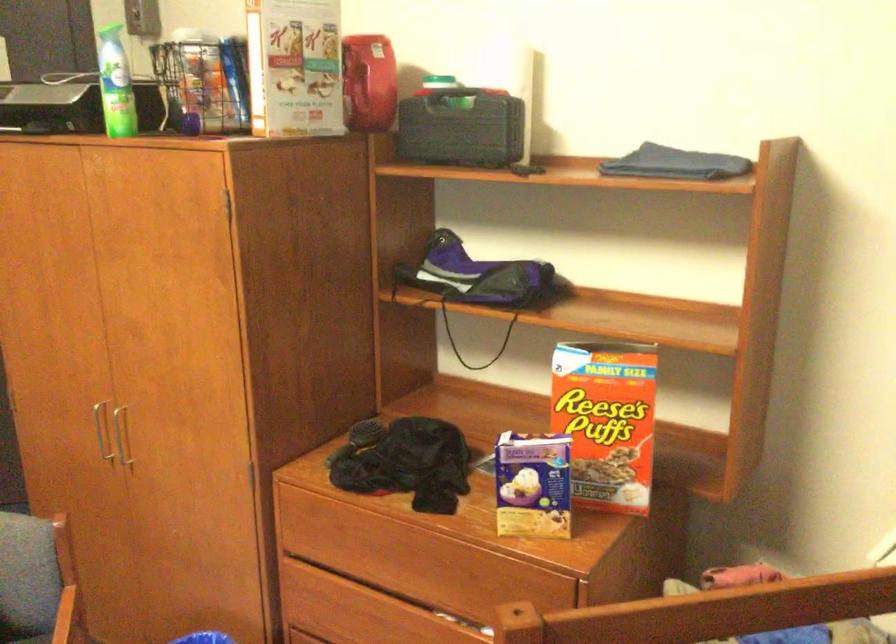
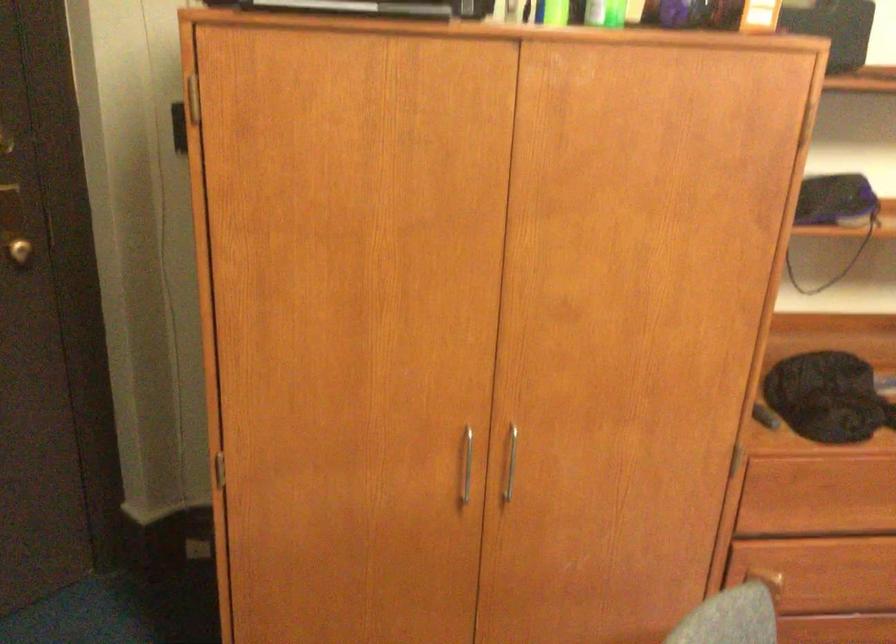
The point at (131, 137) is marked in the first image. Where is the corresponding point in the second image?

(605, 13)